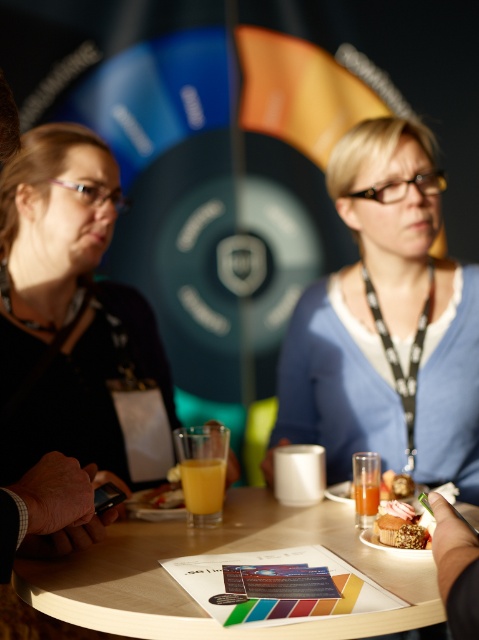
Is matte black shirt at left smaller than translucent glass beverage at table center?

Actually, matte black shirt at left might be larger than translucent glass beverage at table center.

Is matte black shirt at left to the right of translucent glass beverage at table center from the viewer's perspective?

Incorrect, matte black shirt at left is not on the right side of translucent glass beverage at table center.

Is point (53, 196) farther from viewer compared to point (360, 484)?

Yes, point (53, 196) is farther from viewer.

In order to click on matte black shirt at left in this screenshot , I will do `click(70, 346)`.

Find the location of a particular element. wooden table at center is located at coordinates (217, 552).

Who is more distant from viewer, [147,532] or [211,513]?

The point [211,513] is more distant.

Who is more forward, (420,572) or (198,493)?

Point (420,572) is more forward.

What are the coordinates of `wooden table at center` in the screenshot? It's located at (217, 552).

Can you confirm if translucent glass of orange juice at center is shorter than golden textured muffin at lower center?

Incorrect, translucent glass of orange juice at center's height does not fall short of golden textured muffin at lower center's.

Does translucent glass of orange juice at center have a smaller size compared to golden textured muffin at lower center?

Indeed, translucent glass of orange juice at center has a smaller size compared to golden textured muffin at lower center.

This screenshot has width=479, height=640. What do you see at coordinates (203, 484) in the screenshot? I see `translucent glass of orange juice at center` at bounding box center [203, 484].

The height and width of the screenshot is (640, 479). What are the coordinates of `translucent glass of orange juice at center` in the screenshot? It's located at (203, 484).